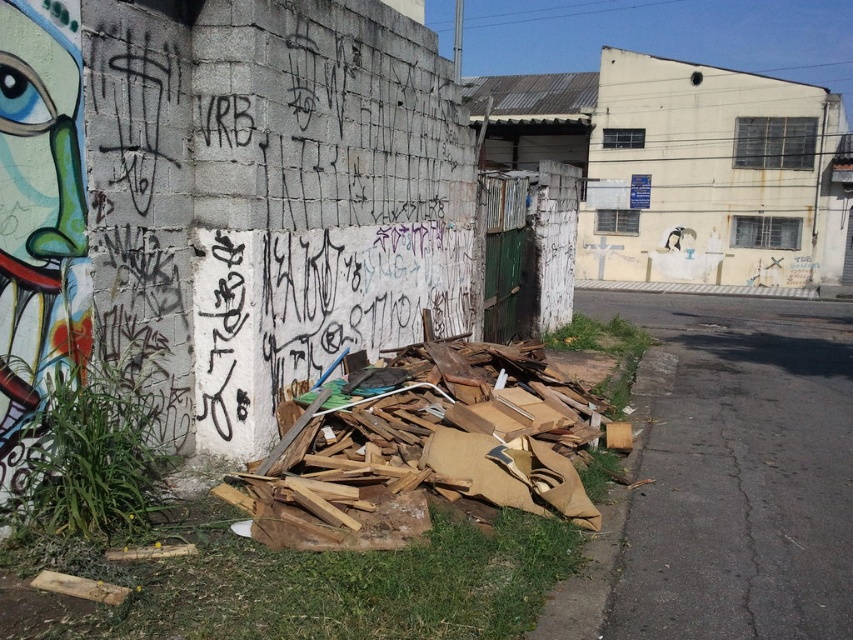
Who is shorter, brown cardboard debris at lower right or brown cardboard at lower left?

brown cardboard at lower left is shorter.

Can you confirm if brown cardboard debris at lower right is positioned below brown cardboard at lower left?

No, brown cardboard debris at lower right is not below brown cardboard at lower left.

Between point (755, 374) and point (489, 480), which one is positioned in front?

Point (489, 480) is more forward.

Find the location of a particular element. This screenshot has height=640, width=853. brown cardboard debris at lower right is located at coordinates (740, 472).